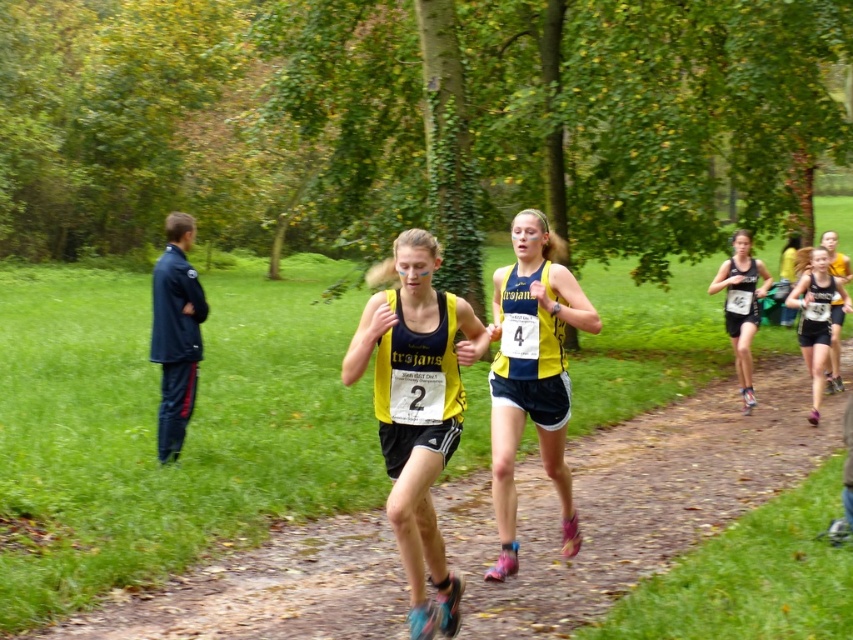
Can you confirm if yellow matte tank top at center is positioned to the left of yellow fabric shorts at center?

Indeed, yellow matte tank top at center is positioned on the left side of yellow fabric shorts at center.

Does yellow matte tank top at center have a lesser width compared to yellow fabric shorts at center?

In fact, yellow matte tank top at center might be wider than yellow fabric shorts at center.

Where is `yellow matte tank top at center`? The height and width of the screenshot is (640, 853). yellow matte tank top at center is located at coordinates (416, 408).

Image resolution: width=853 pixels, height=640 pixels. What are the coordinates of `yellow matte tank top at center` in the screenshot? It's located at (416, 408).

Does point (544, 456) come closer to viewer compared to point (757, 300)?

Yes.

Which is behind, point (502, 480) or point (741, 324)?

Point (741, 324)

At what (x,y) coordinates should I click in order to perform the action: click on yellow fabric shorts at center. Please return your answer as a coordinate pair (x, y). Image resolution: width=853 pixels, height=640 pixels. Looking at the image, I should click on (531, 376).

Is yellow fabric shorts at center positioned behind matte yellow tank top at center?

That is False.

Is yellow fabric shorts at center smaller than matte yellow tank top at center?

Indeed, yellow fabric shorts at center has a smaller size compared to matte yellow tank top at center.

Does point (563, 397) lie behind point (828, 330)?

No, (563, 397) is in front of (828, 330).

Identify the location of yellow fabric shorts at center. (531, 376).